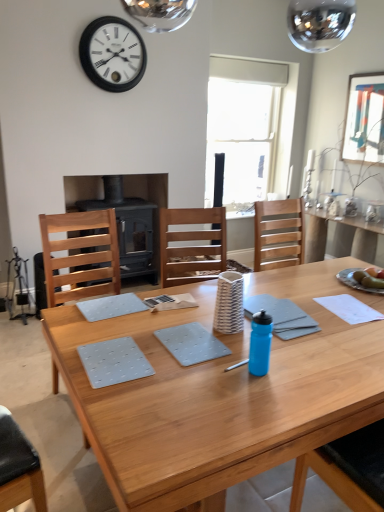
This screenshot has height=512, width=384. What are the coordinates of `free location above white matte wall clock at upper center (from a real-world perspective)` in the screenshot? It's located at (111, 13).